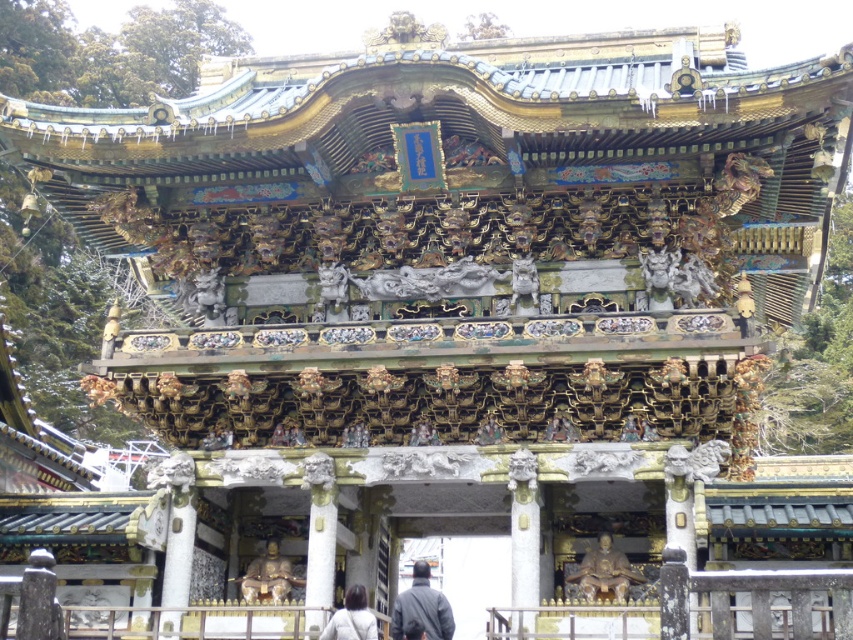
Who is taller, dark gray jacket at center or dark gray fabric jacket at lower center?

Standing taller between the two is dark gray jacket at center.

Who is lower down, dark gray jacket at center or dark gray fabric jacket at lower center?

dark gray jacket at center

This screenshot has height=640, width=853. I want to click on dark gray jacket at center, so click(422, 605).

Does dark gray jacket at center have a greater height compared to gold metallic statue at center?

Correct, dark gray jacket at center is much taller as gold metallic statue at center.

Is dark gray jacket at center closer to the viewer compared to gold metallic statue at center?

Yes, dark gray jacket at center is closer to the viewer.

Where is `dark gray jacket at center`? dark gray jacket at center is located at coordinates (422, 605).

Is gold polished statue at center closer to the viewer compared to dark gray jacket at center?

No.

This screenshot has width=853, height=640. I want to click on gold polished statue at center, so click(604, 572).